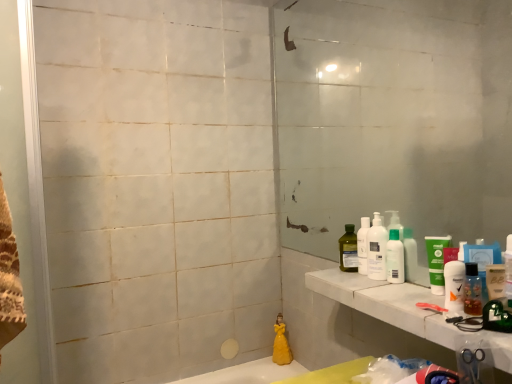
Measure the distance between point (438, 282) and camera.

A distance of 3.84 feet exists between point (438, 282) and camera.

Describe the element at coordinates (436, 262) in the screenshot. I see `green matte tube at right, marked as the 2th mouthwash in a front-to-back arrangement` at that location.

Locate an element on the screen. This screenshot has height=384, width=512. white plastic bottles at right, marked as the second cleaning product in a back-to-front arrangement is located at coordinates (377, 250).

This screenshot has width=512, height=384. What do you see at coordinates (25, 194) in the screenshot?
I see `clear glass screen door at left` at bounding box center [25, 194].

What is the approximate height of clear glass screen door at left?

clear glass screen door at left is 54.23 centimeters tall.

The image size is (512, 384). What are the coordinates of `green matte tube at right, arranged as the 1th mouthwash when viewed from the back` in the screenshot? It's located at (436, 262).

Is transparent glass mirror at right in front of or behind green matte tube at right, arranged as the 1th mouthwash when viewed from the back, in the image?

transparent glass mirror at right is positioned closer to the viewer than green matte tube at right, arranged as the 1th mouthwash when viewed from the back.

Who is taller, transparent glass mirror at right or green matte tube at right, arranged as the 1th mouthwash when viewed from the back?

transparent glass mirror at right is taller.

Considering the sizes of objects translucent plastic bottle at right, marked as the second mouthwash in a back-to-front arrangement, and white plastic bottles at right in the image provided, who is bigger, translucent plastic bottle at right, marked as the second mouthwash in a back-to-front arrangement, or white plastic bottles at right?

With larger size is white plastic bottles at right.

Which is closer, (477, 269) or (391, 278)?

The point (477, 269) is in front.

Is translucent plastic bottle at right, the 1th mouthwash viewed from the front, facing towards white plastic bottles at right?

No, translucent plastic bottle at right, the 1th mouthwash viewed from the front, does not turn towards white plastic bottles at right.

From a real-world perspective, which is physically below, translucent plastic bottle at right, the 1th mouthwash viewed from the front, or white plastic bottles at right?

From a 3D spatial view, translucent plastic bottle at right, the 1th mouthwash viewed from the front, is below.

I want to click on mirror on the right of clear glass screen door at left, so click(x=394, y=118).

Is clear glass screen door at left turned away from transparent glass mirror at right?

No, clear glass screen door at left is not facing away from transparent glass mirror at right.

Is clear glass screen door at left beside transparent glass mirror at right?

No, clear glass screen door at left is not in contact with transparent glass mirror at right.

From the image's perspective, is clear glass screen door at left positioned above or below transparent glass mirror at right?

clear glass screen door at left is situated lower than transparent glass mirror at right in the image.

Is white plastic bottles at right, which is counted as the 2th cleaning product, starting from the left, positioned beyond the bounds of white plastic bottles at right?

Yes, white plastic bottles at right, which is counted as the 2th cleaning product, starting from the left, is not within white plastic bottles at right.

Is white plastic bottles at right, the first cleaning product from the front, oriented away from white plastic bottles at right?

No, white plastic bottles at right is not at the back of white plastic bottles at right, the first cleaning product from the front.

Visually, is white plastic bottles at right, which ranks as the first cleaning product in right-to-left order, positioned to the left or to the right of white plastic bottles at right?

In the image, white plastic bottles at right, which ranks as the first cleaning product in right-to-left order, appears on the left side of white plastic bottles at right.

Considering the sizes of objects white plastic bottles at right, which ranks as the first cleaning product in right-to-left order, and white plastic bottles at right in the image provided, who is thinner, white plastic bottles at right, which ranks as the first cleaning product in right-to-left order, or white plastic bottles at right?

white plastic bottles at right is thinner.

Does point (284, 337) come closer to viewer compared to point (379, 262)?

That is False.

Is white plastic bottles at right, which ranks as the first cleaning product in right-to-left order, completely or partially inside yellow matte figurine at lower center, arranged as the 1th cleaning product when viewed from the left?

No.

Is yellow matte figurine at lower center, arranged as the 2th cleaning product when viewed from the top, at the right side of white plastic bottles at right, which ranks as the first cleaning product in right-to-left order?

No, yellow matte figurine at lower center, arranged as the 2th cleaning product when viewed from the top, is not to the right of white plastic bottles at right, which ranks as the first cleaning product in right-to-left order.

Based on the photo, which of these two, translucent plastic bottle at right, the 1th mouthwash viewed from the front, or clear glass screen door at left, is bigger?

clear glass screen door at left.

Considering the relative sizes of translucent plastic bottle at right, marked as the second mouthwash in a back-to-front arrangement, and clear glass screen door at left in the image provided, is translucent plastic bottle at right, marked as the second mouthwash in a back-to-front arrangement, thinner than clear glass screen door at left?

Yes, translucent plastic bottle at right, marked as the second mouthwash in a back-to-front arrangement, is thinner than clear glass screen door at left.

Can clear glass screen door at left be found inside translucent plastic bottle at right, marked as the second mouthwash in a back-to-front arrangement?

No, clear glass screen door at left is not inside translucent plastic bottle at right, marked as the second mouthwash in a back-to-front arrangement.

Considering the relative positions of translucent plastic bottle at right, the 1th mouthwash viewed from the front, and clear glass screen door at left in the image provided, is translucent plastic bottle at right, the 1th mouthwash viewed from the front, to the left or to the right of clear glass screen door at left?

In the image, translucent plastic bottle at right, the 1th mouthwash viewed from the front, appears on the right side of clear glass screen door at left.

From the image's perspective, is clear glass screen door at left on green matte tube at right, marked as the 2th mouthwash in a front-to-back arrangement?

Yes.

Which of these two, clear glass screen door at left or green matte tube at right, arranged as the 1th mouthwash when viewed from the back, stands shorter?

Standing shorter between the two is green matte tube at right, arranged as the 1th mouthwash when viewed from the back.

Looking at this image, is clear glass screen door at left with green matte tube at right, marked as the 2th mouthwash in a front-to-back arrangement?

clear glass screen door at left is not next to green matte tube at right, marked as the 2th mouthwash in a front-to-back arrangement, and they're not touching.

Where is `mirror located above the green matte tube at right, marked as the 2th mouthwash in a front-to-back arrangement (from a real-world perspective)`? This screenshot has width=512, height=384. mirror located above the green matte tube at right, marked as the 2th mouthwash in a front-to-back arrangement (from a real-world perspective) is located at coordinates [x=394, y=118].

Locate an element on the screen. toiletry on the left of translucent plastic bottle at right, marked as the second mouthwash in a back-to-front arrangement is located at coordinates (395, 258).

Based on their spatial positions, is green matte tube at right, arranged as the 1th mouthwash when viewed from the back, or white marble counter top at right further from white plastic bottles at right?

white marble counter top at right is further to white plastic bottles at right.

When comparing their distances from translucent plastic bottle at right, marked as the second mouthwash in a back-to-front arrangement, does white marble counter top at right or white plastic bottles at right, acting as the second cleaning product starting from the bottom, seem further?

Based on the image, white plastic bottles at right, acting as the second cleaning product starting from the bottom, appears to be further to translucent plastic bottle at right, marked as the second mouthwash in a back-to-front arrangement.

When comparing their distances from transparent glass mirror at right, does yellow matte figurine at lower center, arranged as the 1th cleaning product when viewed from the left, or translucent plastic bottle at right, marked as the second mouthwash in a back-to-front arrangement, seem closer?

The object closer to transparent glass mirror at right is translucent plastic bottle at right, marked as the second mouthwash in a back-to-front arrangement.

Consider the image. From the image, which object appears to be nearer to white plastic bottles at right, white plastic bottles at right, which ranks as the first cleaning product in right-to-left order, or white marble counter top at right?

white plastic bottles at right, which ranks as the first cleaning product in right-to-left order, lies closer to white plastic bottles at right than the other object.

Estimate the real-world distances between objects in this image. Which object is closer to green matte tube at right, arranged as the 1th mouthwash when viewed from the back, transparent glass mirror at right or white plastic bottles at right?

The object closer to green matte tube at right, arranged as the 1th mouthwash when viewed from the back, is white plastic bottles at right.

Considering their positions, is green matte tube at right, marked as the 2th mouthwash in a front-to-back arrangement, positioned closer to yellow matte figurine at lower center, which ranks as the first cleaning product in back-to-front order, than white plastic bottles at right, the 1th cleaning product positioned from the top?

Among the two, white plastic bottles at right, the 1th cleaning product positioned from the top, is located nearer to yellow matte figurine at lower center, which ranks as the first cleaning product in back-to-front order.

Based on their spatial positions, is green matte tube at right, marked as the 2th mouthwash in a front-to-back arrangement, or yellow matte figurine at lower center, arranged as the 2th cleaning product when viewed from the top, further from transparent glass mirror at right?

Based on the image, yellow matte figurine at lower center, arranged as the 2th cleaning product when viewed from the top, appears to be further to transparent glass mirror at right.

Based on the photo, looking at the image, which one is located further to white plastic bottles at right, marked as the second cleaning product in a back-to-front arrangement, clear glass screen door at left or white marble counter top at right?

clear glass screen door at left lies further to white plastic bottles at right, marked as the second cleaning product in a back-to-front arrangement, than the other object.

This screenshot has width=512, height=384. In order to click on mirror between clear glass screen door at left and translucent plastic bottle at right, marked as the second mouthwash in a back-to-front arrangement in this screenshot , I will do `click(394, 118)`.

Locate an element on the screen. toiletry between clear glass screen door at left and green matte tube at right, arranged as the 1th mouthwash when viewed from the back, in the horizontal direction is located at coordinates coord(395,258).

Where is `mirror located between clear glass screen door at left and white plastic bottles at right, the first cleaning product from the front, in the left-right direction`? This screenshot has height=384, width=512. mirror located between clear glass screen door at left and white plastic bottles at right, the first cleaning product from the front, in the left-right direction is located at coordinates (394, 118).

At what (x,y) coordinates should I click in order to perform the action: click on cleaning product that lies between transparent glass mirror at right and white plastic bottles at right from top to bottom. Please return your answer as a coordinate pair (x, y). This screenshot has width=512, height=384. Looking at the image, I should click on (377, 250).